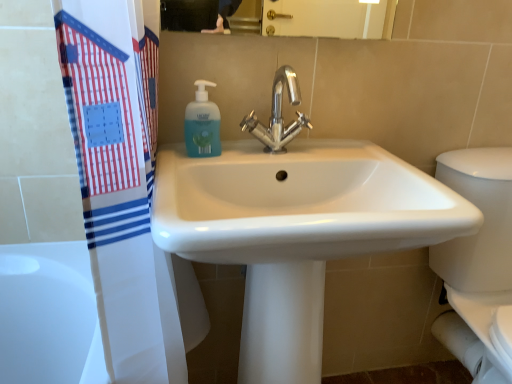
I want to click on vacant region to the left of polished chrome faucet at center, so click(217, 163).